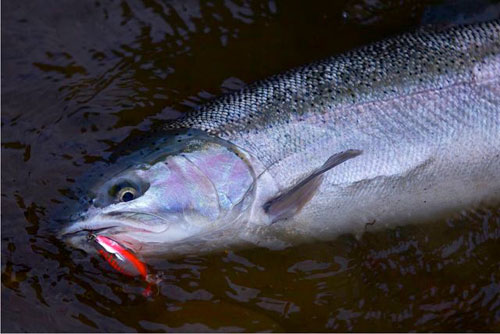
The image size is (500, 334). I want to click on hook, so click(x=158, y=277), click(x=83, y=237).